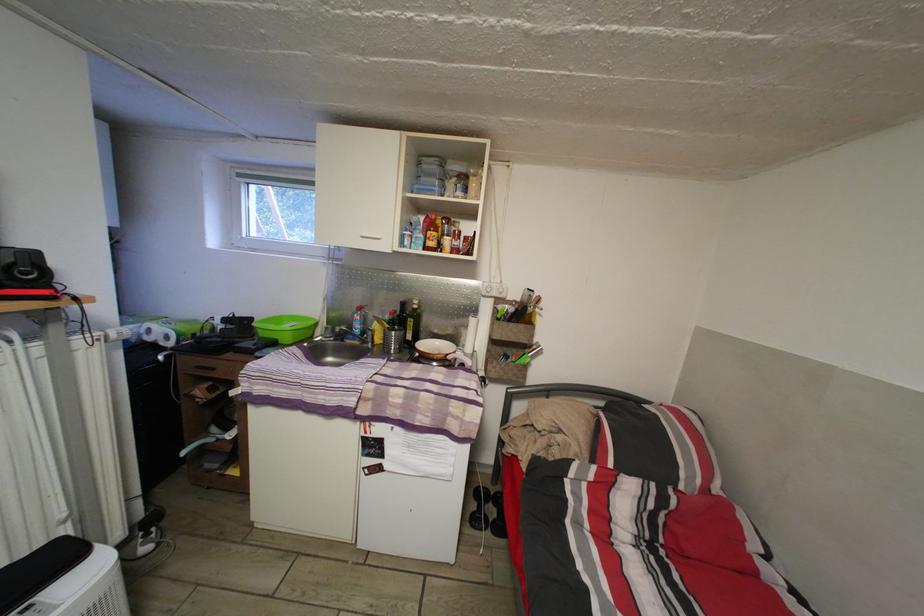
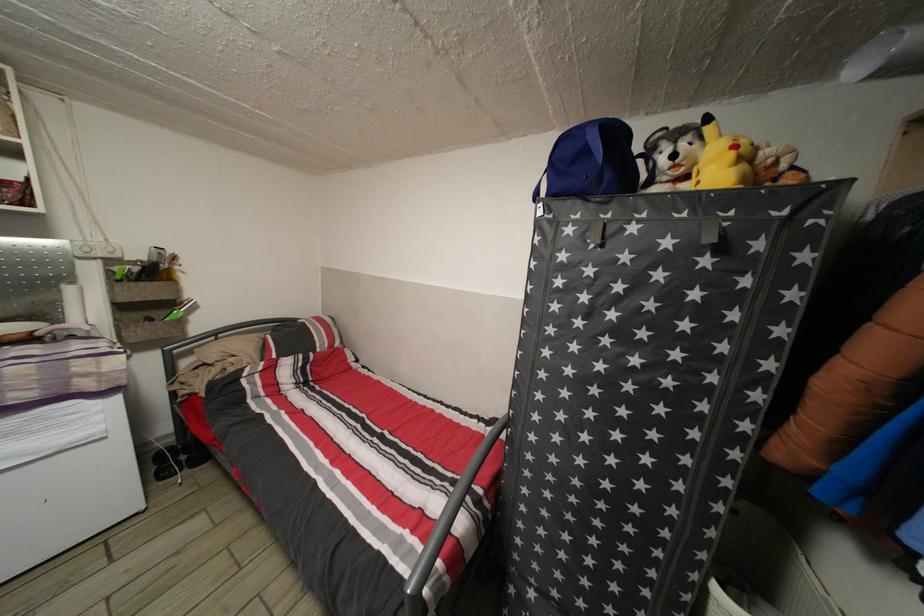
In the second image, find the point that corresponds to (493,498) in the first image.

(177, 455)